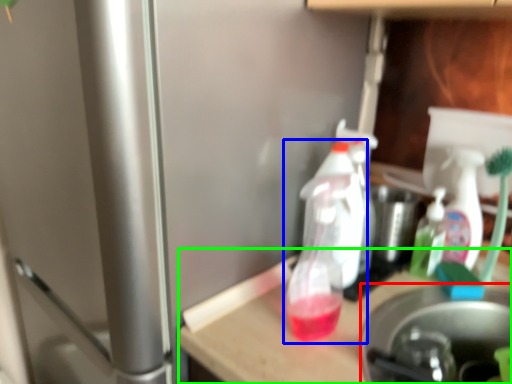
Question: Which is farther away from appliance (highlighted by a red box)? bottle (highlighted by a blue box) or table (highlighted by a green box)?

Choices:
 (A) bottle
 (B) table

Answer: (A)